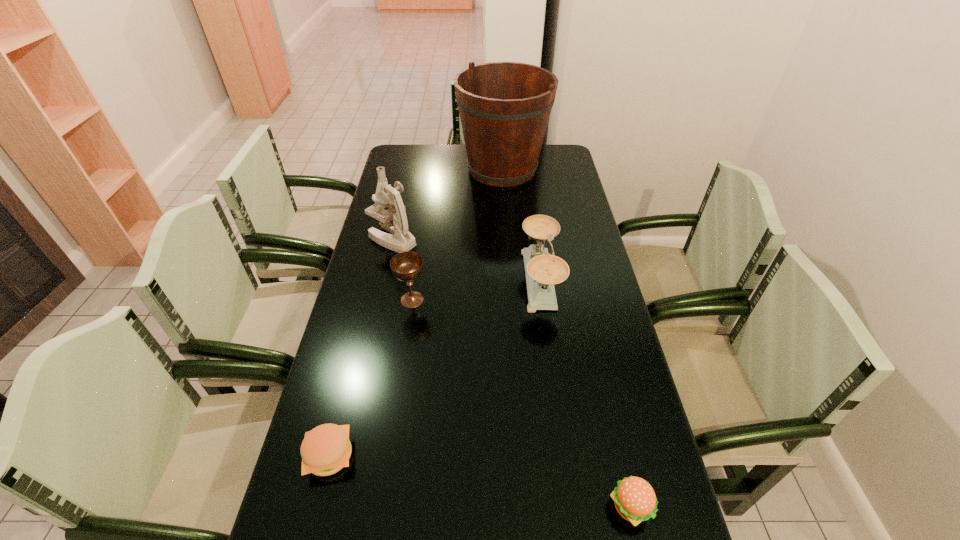
You are a GUI agent. You are given a task and a screenshot of the screen. Output one action in this format:
    pyautogui.click(x=<x>, y=<y>)
    Task: Click on the free space that satisfies the following two spatial constraints: 1. on the front-facing side of the nearer hamburger; 2. on the right side of the fourth shortest object
    The height and width of the screenshot is (540, 960).
    Given the screenshot: What is the action you would take?
    pyautogui.click(x=572, y=507)

Image resolution: width=960 pixels, height=540 pixels. Find the location of `free point that satisfies the following two spatial constraints: 1. on the front side of the tallest object; 2. on the right side of the nearer hamburger`. free point that satisfies the following two spatial constraints: 1. on the front side of the tallest object; 2. on the right side of the nearer hamburger is located at coordinates (526, 507).

Identify the location of free space in the image that satisfies the following two spatial constraints: 1. on the front side of the microscope; 2. on the right side of the nearer hamburger. The width and height of the screenshot is (960, 540). (333, 507).